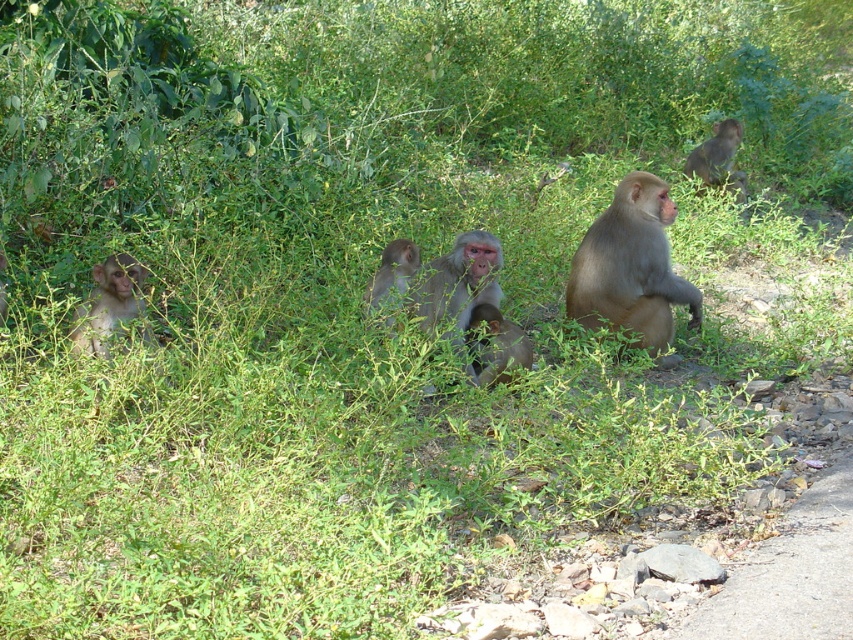
Does point (708, 141) lie in front of point (389, 317)?

No, it is not.

Does brown furry monkey at upper right appear on the right side of gray fur monkey at center?

Yes, brown furry monkey at upper right is to the right of gray fur monkey at center.

Who is more distant from viewer, (735, 180) or (386, 276)?

Point (735, 180)

Find the location of a particular element. Image resolution: width=853 pixels, height=640 pixels. brown furry monkey at upper right is located at coordinates (718, 157).

Consider the image. Can you confirm if brown fur monkey at lower left is thinner than brown furry monkey at center?

No, brown fur monkey at lower left is not thinner than brown furry monkey at center.

Measure the distance between brown fur monkey at lower left and camera.

The distance of brown fur monkey at lower left from camera is 4.22 meters.

You are a GUI agent. You are given a task and a screenshot of the screen. Output one action in this format:
    pyautogui.click(x=<x>, y=<y>)
    Task: Click on the brown fur monkey at lower left
    Image resolution: width=853 pixels, height=640 pixels.
    Given the screenshot: What is the action you would take?
    pyautogui.click(x=108, y=304)

Who is lower down, light brown fur monkey at center or brown fur monkey at center?

brown fur monkey at center is lower down.

What do you see at coordinates (630, 266) in the screenshot?
I see `light brown fur monkey at center` at bounding box center [630, 266].

This screenshot has width=853, height=640. I want to click on light brown fur monkey at center, so click(630, 266).